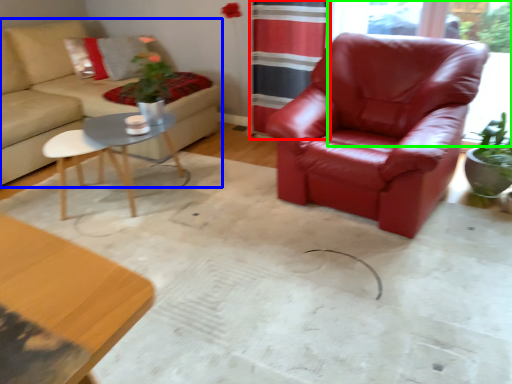
Question: Which object is positioned farthest from curtain (highlighted by a red box)? Select from studio couch (highlighted by a blue box) and window screen (highlighted by a green box).

Choices:
 (A) studio couch
 (B) window screen

Answer: (B)